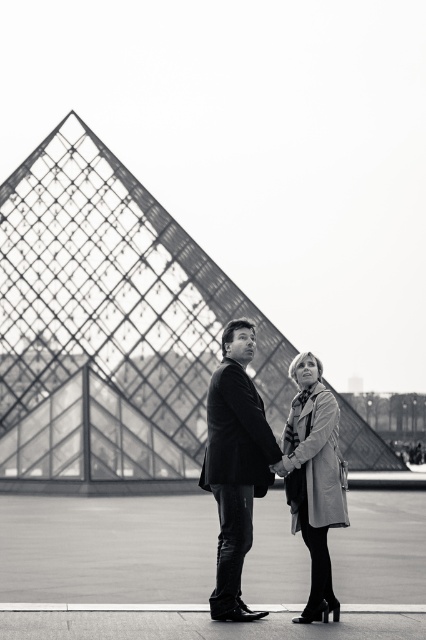
Is glass lattice pyramid at center below light gray wool coat at center?

No, glass lattice pyramid at center is not below light gray wool coat at center.

Describe the element at coordinates (109, 323) in the screenshot. I see `glass lattice pyramid at center` at that location.

What do you see at coordinates (109, 323) in the screenshot?
I see `glass lattice pyramid at center` at bounding box center [109, 323].

This screenshot has height=640, width=426. I want to click on glass lattice pyramid at center, so click(109, 323).

Can you confirm if glass lattice pyramid at center is positioned to the left of matte black suit at center?

Correct, you'll find glass lattice pyramid at center to the left of matte black suit at center.

Does point (14, 458) come in front of point (238, 442)?

That is False.

At what (x,y) coordinates should I click in order to perform the action: click on glass lattice pyramid at center. Please return your answer as a coordinate pair (x, y). Looking at the image, I should click on (109, 323).

Between matte black suit at center and light gray wool coat at center, which one is positioned higher?

Positioned higher is matte black suit at center.

Between point (245, 384) and point (314, 598), which one is positioned in front?

Point (314, 598) is more forward.

This screenshot has width=426, height=640. Find the location of `matte black suit at center`. matte black suit at center is located at coordinates (236, 465).